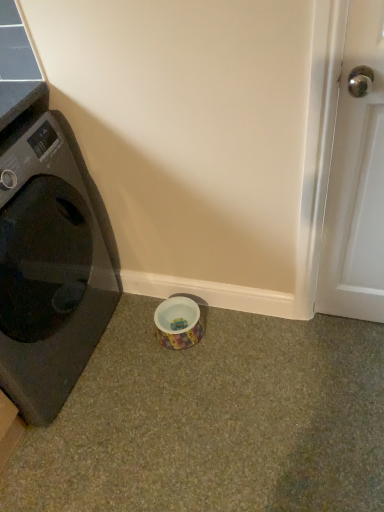
At what (x,y) coordinates should I click in order to perform the action: click on vacant area to the right of multicolored ceramic bowl at lower center. Please return your answer as a coordinate pair (x, y). The image size is (384, 512). Looking at the image, I should click on (229, 333).